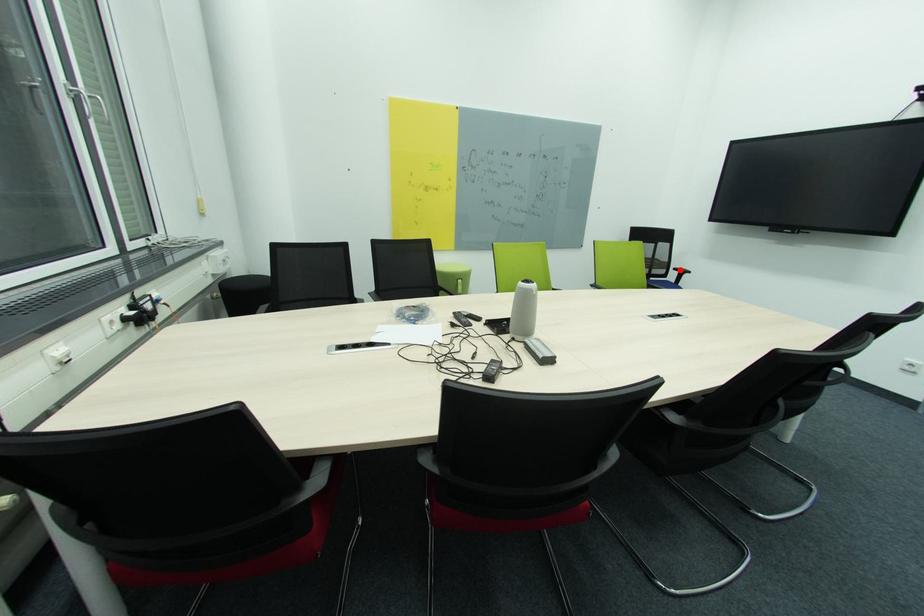
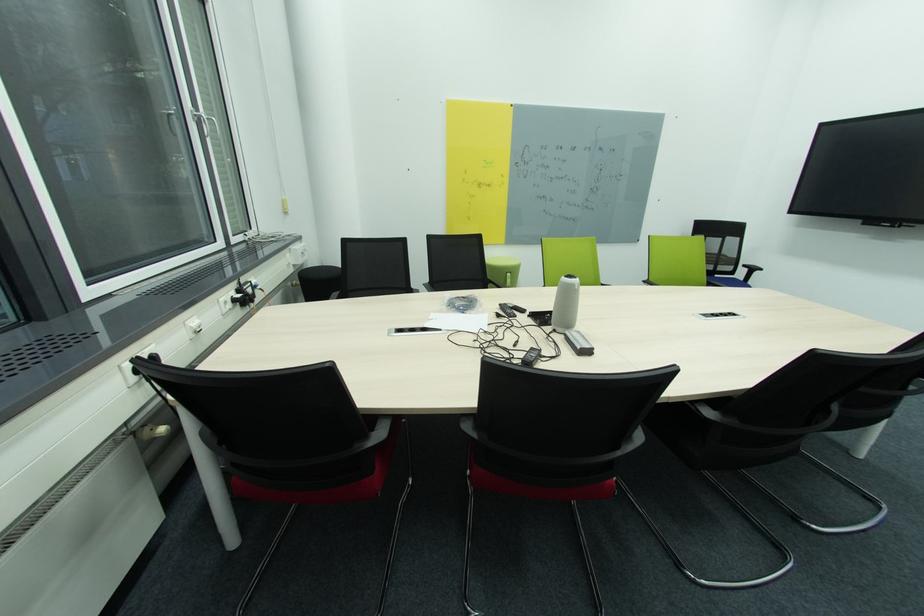
Question: I am providing you with two images of the same scene from different viewpoints. In image1, a red point is highlighted. Considering the same 3D point in image2, which of the following is correct?

Choices:
 (A) It is closer
 (B) It is farther

Answer: (B)